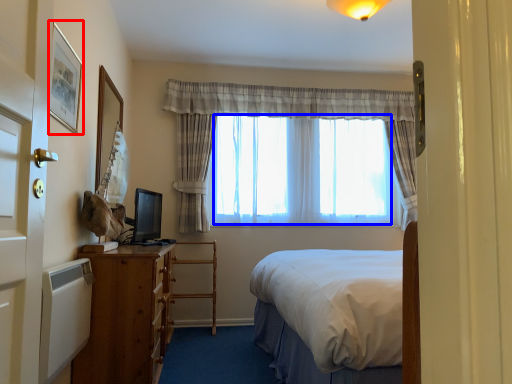
Question: Which object appears closest to the camera in this image, picture frame (highlighted by a red box) or window screen (highlighted by a blue box)?

Choices:
 (A) picture frame
 (B) window screen

Answer: (A)